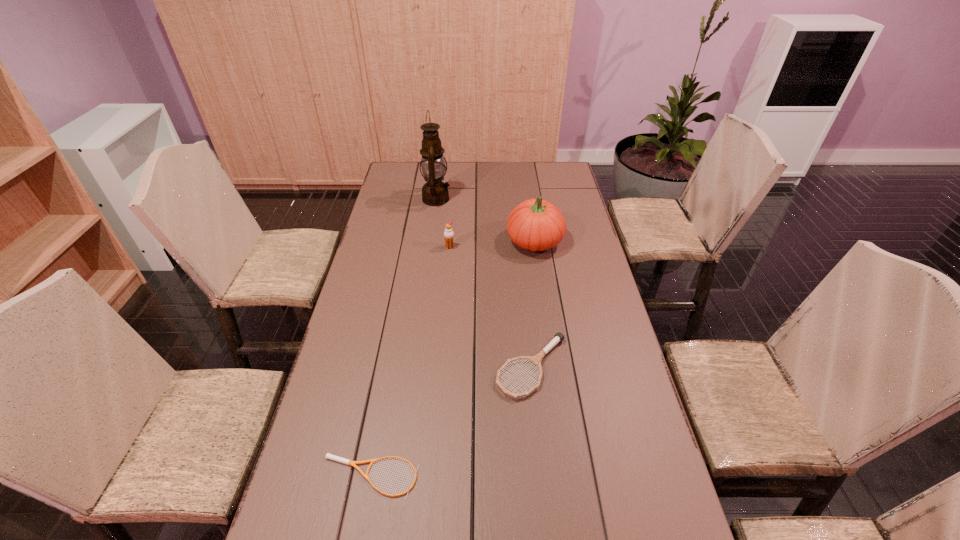
Image resolution: width=960 pixels, height=540 pixels. I want to click on the farthest object, so 435,192.

This screenshot has width=960, height=540. Identify the location of oil lamp. (435, 192).

Identify the location of the second tallest object. (535, 224).

At what (x,y) coordinates should I click in order to perform the action: click on the third tallest object. Please return your answer as a coordinate pair (x, y). This screenshot has height=540, width=960. Looking at the image, I should click on (448, 233).

The image size is (960, 540). I want to click on the right tennis racket, so click(x=559, y=337).

This screenshot has width=960, height=540. Find the location of `the farther tennis racket`. the farther tennis racket is located at coordinates (559, 337).

This screenshot has width=960, height=540. What are the coordinates of `the left tennis racket` in the screenshot? It's located at (328, 456).

Image resolution: width=960 pixels, height=540 pixels. In order to click on the shorter tennis racket in this screenshot , I will do `click(328, 456)`.

Identify the location of vacant space situated 0.080m on the left of the oil lamp. The width and height of the screenshot is (960, 540). (403, 199).

At what (x,y) coordinates should I click in order to perform the action: click on vacant space situated on the front of the fourth shortest object. Please return your answer as a coordinate pair (x, y). This screenshot has width=960, height=540. Looking at the image, I should click on (542, 295).